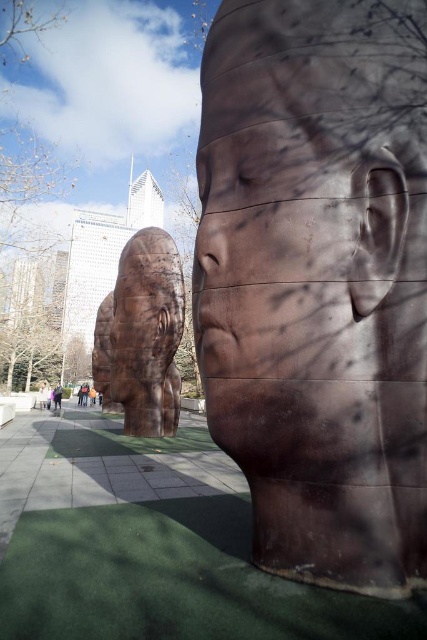
Question: Which point is farther to the camera?

Choices:
 (A) (221, 353)
 (B) (143, 365)

Answer: (B)

Question: Which object is farther from the camera taking this photo?

Choices:
 (A) rusty metal face at center
 (B) rusty metal head at center

Answer: (B)

Question: In this image, where is rusty metal face at center located relative to rusty metal head at center?

Choices:
 (A) left
 (B) right

Answer: (B)

Question: Is rusty metal face at center to the left of rusty metal head at center from the viewer's perspective?

Choices:
 (A) no
 (B) yes

Answer: (A)

Question: Is rusty metal face at center further to the viewer compared to rusty metal head at center?

Choices:
 (A) no
 (B) yes

Answer: (A)